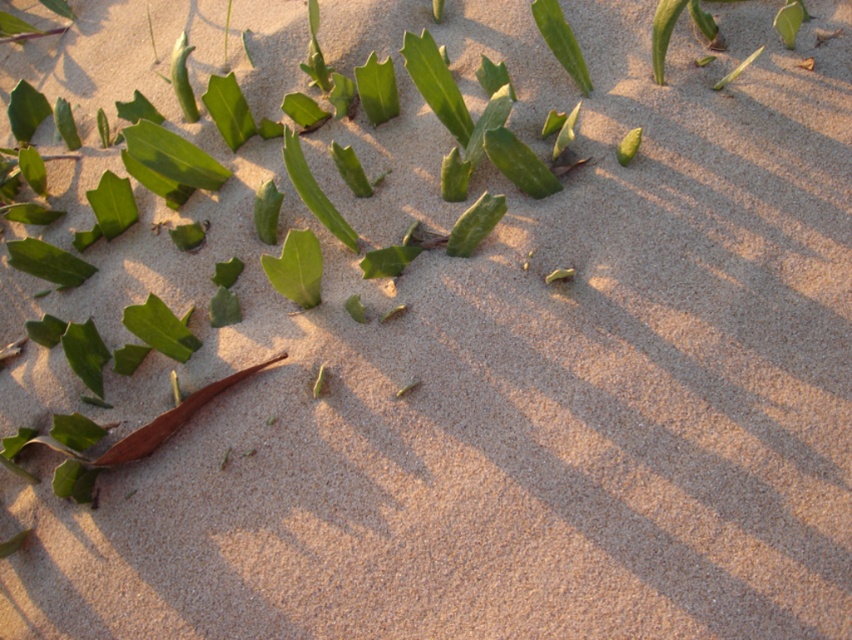
You are an artist sketching the scene and want to ensure accurate proportions. Which leaf, the green matte leaf at center or the green matte leaf at upper center, is wider?

The green matte leaf at upper center is wider than the green matte leaf at center.

You are standing on the sandy surface and want to pick up the green matte leaf at center. Based on its 2D coordinates, in which direction should you move from your current position at the origin point to reach it?

The green matte leaf at center is located at coordinates point (296, 268), so you should move northeast to reach it.

You are standing on the sandy surface and want to pick up the green matte leaf at center and the green matte leaf at upper center. Which leaf should you reach for first to pick up the closer one?

The green matte leaf at center is closer to the viewer, so you should reach for it first to pick up the closer one.